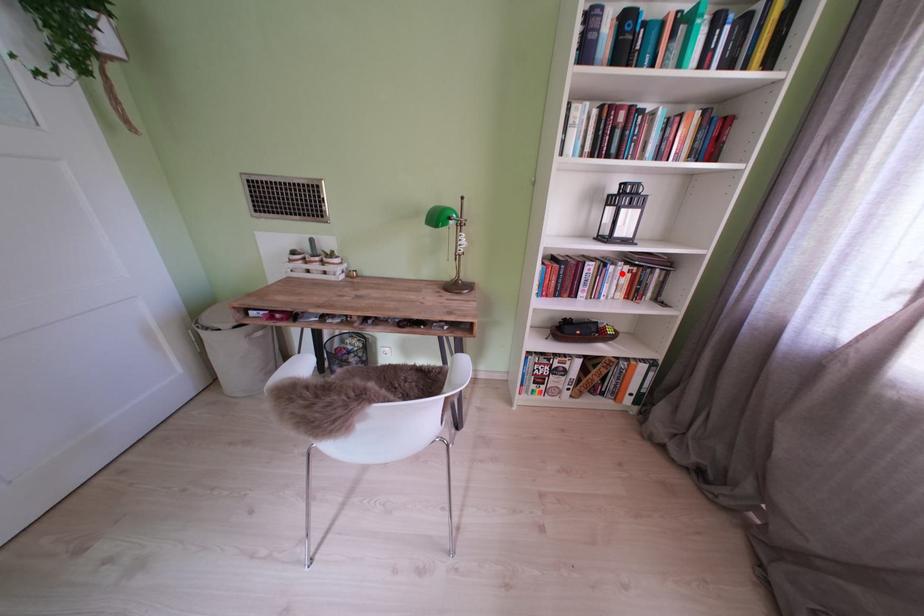
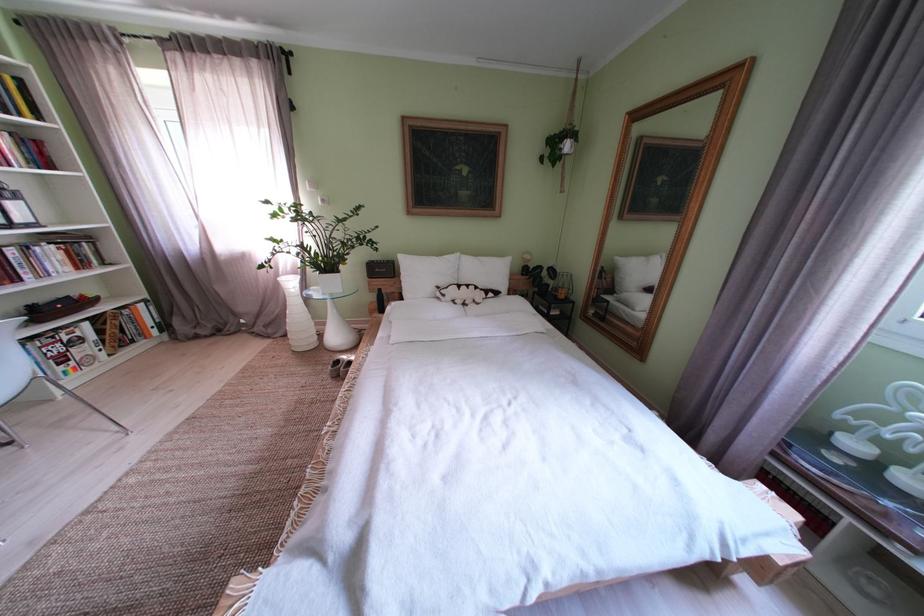
Question: I am providing you with two images of the same scene from different viewpoints. In image1, a red point is highlighted. Considering the same 3D point in image2, which of the following is correct?

Choices:
 (A) It is closer
 (B) It is farther

Answer: (B)